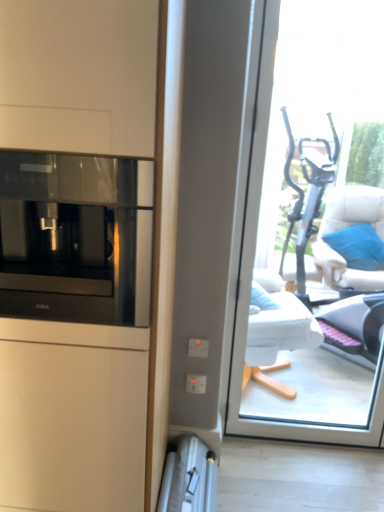
The height and width of the screenshot is (512, 384). What do you see at coordinates (312, 231) in the screenshot? I see `transparent glass window at center` at bounding box center [312, 231].

You are a GUI agent. You are given a task and a screenshot of the screen. Output one action in this format:
    pyautogui.click(x=<x>, y=<y>)
    Task: Click on the silver metallic ladder at lower center
    This screenshot has height=512, width=384.
    Given the screenshot: What is the action you would take?
    pyautogui.click(x=188, y=477)

Would you say transparent glass window at center is a long distance from silver metallic ladder at lower center?

Yes, transparent glass window at center and silver metallic ladder at lower center are located far from each other.

Is transparent glass window at center not within silver metallic ladder at lower center?

Yes.

Considering the relative sizes of transparent glass window at center and silver metallic ladder at lower center in the image provided, is transparent glass window at center bigger than silver metallic ladder at lower center?

Yes.

Identify the location of appliance below the transparent glass window at center (from the image's perspective). The height and width of the screenshot is (512, 384). (188, 477).

Considering the relative positions of white fabric chair at right and transparent glass window at center in the image provided, is white fabric chair at right behind transparent glass window at center?

Yes, the depth of white fabric chair at right is greater than that of transparent glass window at center.

From a real-world perspective, which object rests below the other?

white fabric chair at right is physically lower.

Consider the image. Is white fabric chair at right taller than transparent glass window at center?

Incorrect, the height of white fabric chair at right is not larger of that of transparent glass window at center.

Is black glass microwave at left a part of transparent glass window at center?

Definitely not — black glass microwave at left is not inside transparent glass window at center.

Is transparent glass window at center aimed at black glass microwave at left?

No, transparent glass window at center is not aimed at black glass microwave at left.

Visually, is transparent glass window at center positioned to the left or to the right of black glass microwave at left?

In the image, transparent glass window at center appears on the right side of black glass microwave at left.

Consider the image. From the image's perspective, is black glass microwave at left located above or below white fabric chair at right?

black glass microwave at left is above white fabric chair at right.

Is black glass microwave at left closer to the viewer compared to white fabric chair at right?

Yes.

Which is more to the right, black glass microwave at left or white fabric chair at right?

white fabric chair at right is more to the right.

From a real-world perspective, is black glass microwave at left above or below white fabric chair at right?

In terms of real-world spatial position, black glass microwave at left is above white fabric chair at right.

Which is more to the right, silver metallic ladder at lower center or transparent glass window at center?

transparent glass window at center is more to the right.

Are silver metallic ladder at lower center and transparent glass window at center beside each other?

No, silver metallic ladder at lower center is not making contact with transparent glass window at center.

From a real-world perspective, which object rests below the other?

silver metallic ladder at lower center, from a real-world perspective.

From the image's perspective, is white fabric chair at right located beneath silver metallic ladder at lower center?

No, from the image's perspective, white fabric chair at right is not beneath silver metallic ladder at lower center.

Between point (320, 263) and point (209, 505), which one is positioned behind?

The point (320, 263) is farther.

Can silver metallic ladder at lower center be found inside white fabric chair at right?

No, silver metallic ladder at lower center is located outside of white fabric chair at right.

Is white fabric chair at right far from silver metallic ladder at lower center?

Absolutely, white fabric chair at right is distant from silver metallic ladder at lower center.

From the picture: In terms of size, does white fabric chair at right appear bigger or smaller than black glass microwave at left?

In the image, white fabric chair at right appears to be larger than black glass microwave at left.

Considering the positions of points (342, 199) and (68, 315), is point (342, 199) farther from camera compared to point (68, 315)?

That is True.

Is white fabric chair at right to the left of black glass microwave at left from the viewer's perspective?

No.

In terms of height, does white fabric chair at right look taller or shorter compared to black glass microwave at left?

Clearly, white fabric chair at right is taller compared to black glass microwave at left.

Find the location of a particular element. The height and width of the screenshot is (512, 384). appliance directly beneath the transparent glass window at center (from a real-world perspective) is located at coordinates (x=188, y=477).

The height and width of the screenshot is (512, 384). In order to click on furniture behind the transparent glass window at center in this screenshot , I will do `click(345, 227)`.

Considering their positions, is silver metallic ladder at lower center positioned closer to white fabric chair at right than transparent glass window at center?

transparent glass window at center.

When comparing their distances from black glass microwave at left, does silver metallic ladder at lower center or transparent glass window at center seem closer?

The object closer to black glass microwave at left is silver metallic ladder at lower center.

When comparing their distances from black glass microwave at left, does white fabric chair at right or silver metallic ladder at lower center seem further?

white fabric chair at right lies further to black glass microwave at left than the other object.

Consider the image. Based on their spatial positions, is white fabric chair at right or silver metallic ladder at lower center further from transparent glass window at center?

silver metallic ladder at lower center is further to transparent glass window at center.

When comparing their distances from transparent glass window at center, does black glass microwave at left or silver metallic ladder at lower center seem further?

black glass microwave at left.

Looking at the image, which one is located further to black glass microwave at left, white fabric chair at right or transparent glass window at center?

white fabric chair at right.

Based on their spatial positions, is white fabric chair at right or transparent glass window at center closer to silver metallic ladder at lower center?

transparent glass window at center lies closer to silver metallic ladder at lower center than the other object.

When comparing their distances from white fabric chair at right, does black glass microwave at left or silver metallic ladder at lower center seem further?

black glass microwave at left lies further to white fabric chair at right than the other object.

In order to click on window between black glass microwave at left and white fabric chair at right along the z-axis in this screenshot , I will do `click(312, 231)`.

The image size is (384, 512). In order to click on window between black glass microwave at left and silver metallic ladder at lower center vertically in this screenshot , I will do `click(312, 231)`.

Where is `window between silver metallic ladder at lower center and white fabric chair at right from front to back`? window between silver metallic ladder at lower center and white fabric chair at right from front to back is located at coordinates (312, 231).

This screenshot has width=384, height=512. Find the location of `appliance located between black glass microwave at left and white fabric chair at right in the depth direction`. appliance located between black glass microwave at left and white fabric chair at right in the depth direction is located at coordinates (188, 477).